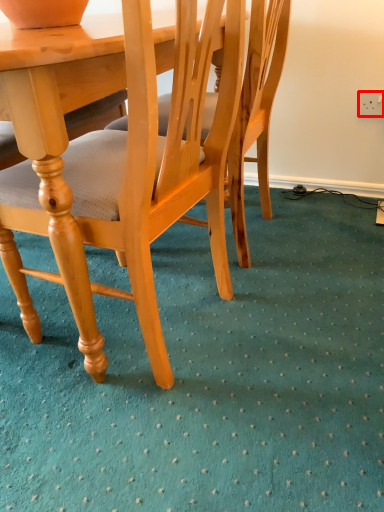
Question: From the image's perspective, where is power outlet (annotated by the red box) located relative to chair?

Choices:
 (A) above
 (B) below

Answer: (A)